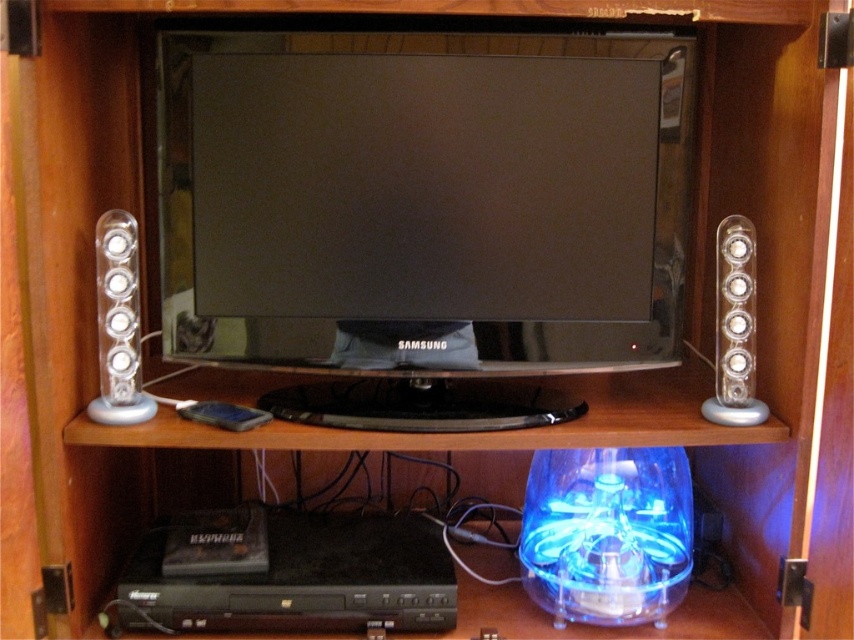
Question: Can you confirm if clear plastic speaker at left is bigger than clear plastic speaker at right?

Choices:
 (A) no
 (B) yes

Answer: (A)

Question: Which object is positioned farthest from the satin black flat screen at center?

Choices:
 (A) clear plastic speaker at left
 (B) clear plastic speaker at right

Answer: (B)

Question: Which object is the farthest from the clear plastic speaker at left?

Choices:
 (A) satin black flat screen at center
 (B) clear plastic speaker at right

Answer: (B)

Question: Does satin black flat screen at center have a greater width compared to clear plastic speaker at right?

Choices:
 (A) yes
 (B) no

Answer: (A)

Question: In this image, where is satin black flat screen at center located relative to clear plastic speaker at left?

Choices:
 (A) below
 (B) above

Answer: (B)

Question: Which of the following is the closest to the observer?

Choices:
 (A) (653, 237)
 (B) (104, 237)

Answer: (B)